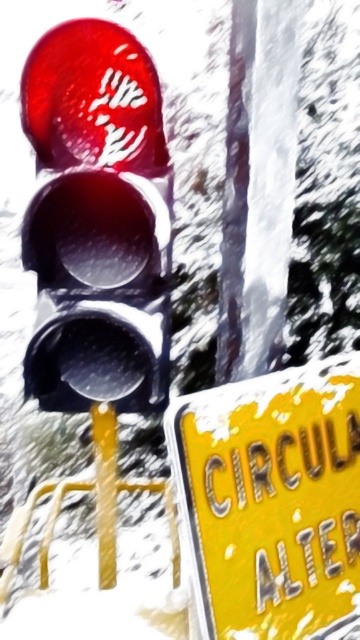
Is matte glass traffic light at left shorter than yellow matte sign at lower right?

Incorrect, matte glass traffic light at left's height does not fall short of yellow matte sign at lower right's.

Between point (105, 392) and point (191, 518), which one is positioned behind?

The point (105, 392) is behind.

The width and height of the screenshot is (360, 640). Identify the location of matte glass traffic light at left. (96, 218).